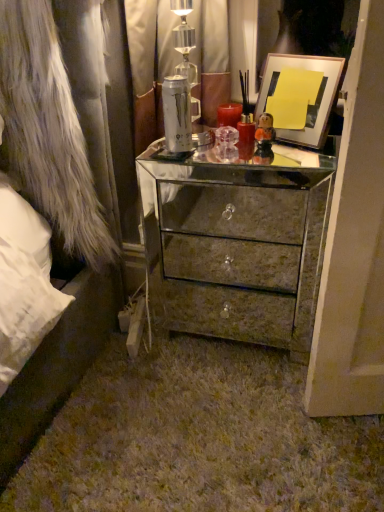
Where is `space that is in front of mirrored metallic chest of drawers at center`? This screenshot has width=384, height=512. space that is in front of mirrored metallic chest of drawers at center is located at coordinates (230, 418).